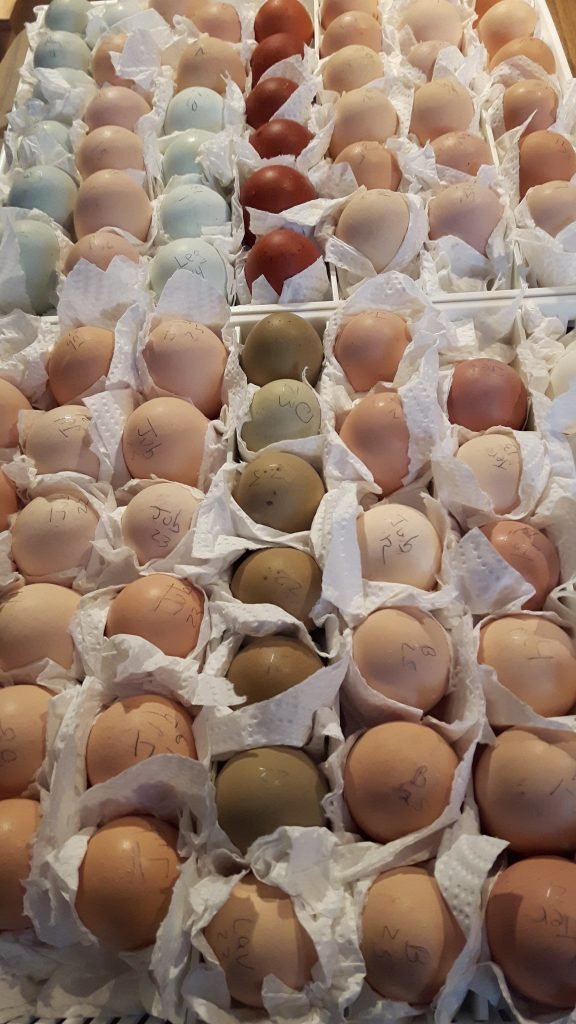
Identify the location of dividers. (486, 303), (481, 298), (241, 318), (238, 306).